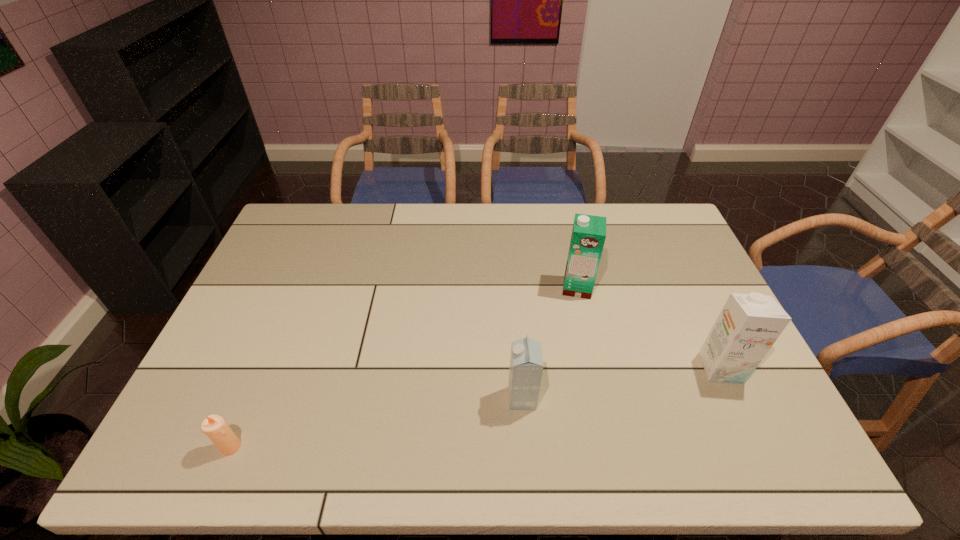
The width and height of the screenshot is (960, 540). In order to click on free space that satisfies the following two spatial constraints: 1. on the back side of the candle; 2. on the right side of the farthest carton in this screenshot , I will do `click(298, 287)`.

In order to click on free location that satisfies the following two spatial constraints: 1. on the back side of the farthest carton; 2. on the right side of the nearest object in this screenshot , I will do `click(298, 287)`.